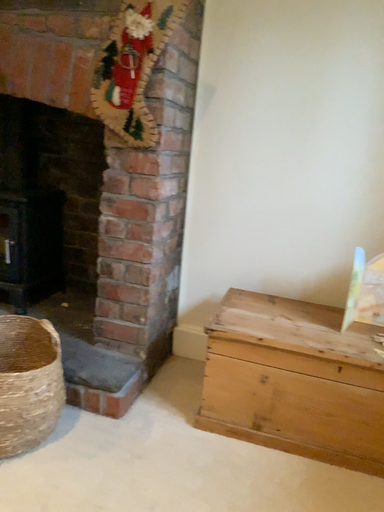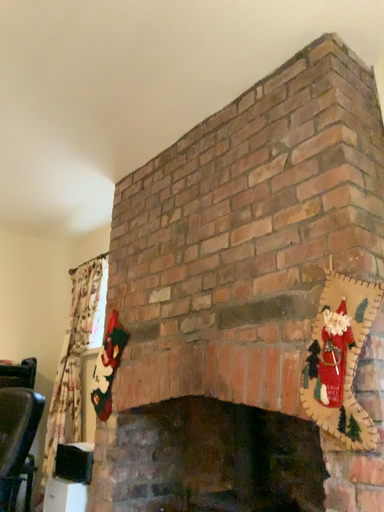
Question: How did the camera likely rotate when shooting the video?

Choices:
 (A) rotated upward
 (B) rotated downward

Answer: (A)